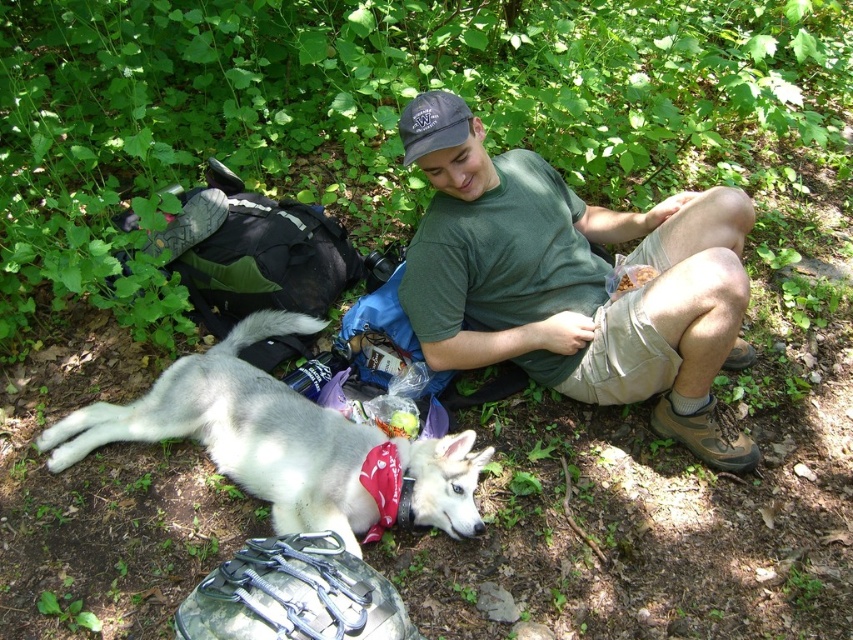
Is white fur dog at lower left taller than dark gray fabric baseball cap at center?

Yes.

Between white fur dog at lower left and dark gray fabric baseball cap at center, which one has more height?

With more height is white fur dog at lower left.

At what (x,y) coordinates should I click in order to perform the action: click on white fur dog at lower left. Please return your answer as a coordinate pair (x, y). This screenshot has width=853, height=640. Looking at the image, I should click on (280, 442).

Can you confirm if green cotton shirt at center is positioned to the left of dark gray fabric baseball cap at center?

In fact, green cotton shirt at center is to the right of dark gray fabric baseball cap at center.

Who is taller, green cotton shirt at center or dark gray fabric baseball cap at center?

green cotton shirt at center is taller.

Image resolution: width=853 pixels, height=640 pixels. What are the coordinates of `green cotton shirt at center` in the screenshot? It's located at (581, 289).

In the scene shown: Is green cotton shirt at center bigger than white fur dog at lower left?

Correct, green cotton shirt at center is larger in size than white fur dog at lower left.

Does point (534, 192) come in front of point (427, 461)?

No.

At what (x,y) coordinates should I click in order to perform the action: click on green cotton shirt at center. Please return your answer as a coordinate pair (x, y). The width and height of the screenshot is (853, 640). Looking at the image, I should click on (581, 289).

Find the location of a particular element. The height and width of the screenshot is (640, 853). green cotton shirt at center is located at coordinates (581, 289).